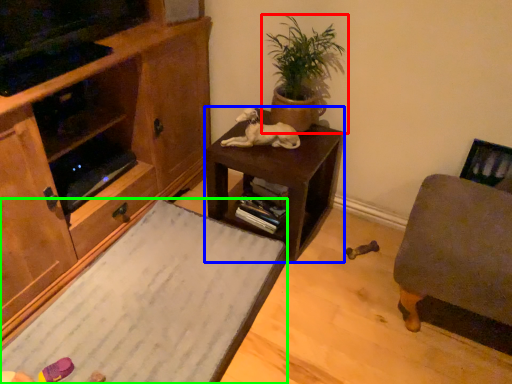
Question: Which object is positioned closest to houseplant (highlighted by a red box)? Select from table (highlighted by a blue box) and desk (highlighted by a green box).

Choices:
 (A) table
 (B) desk

Answer: (A)